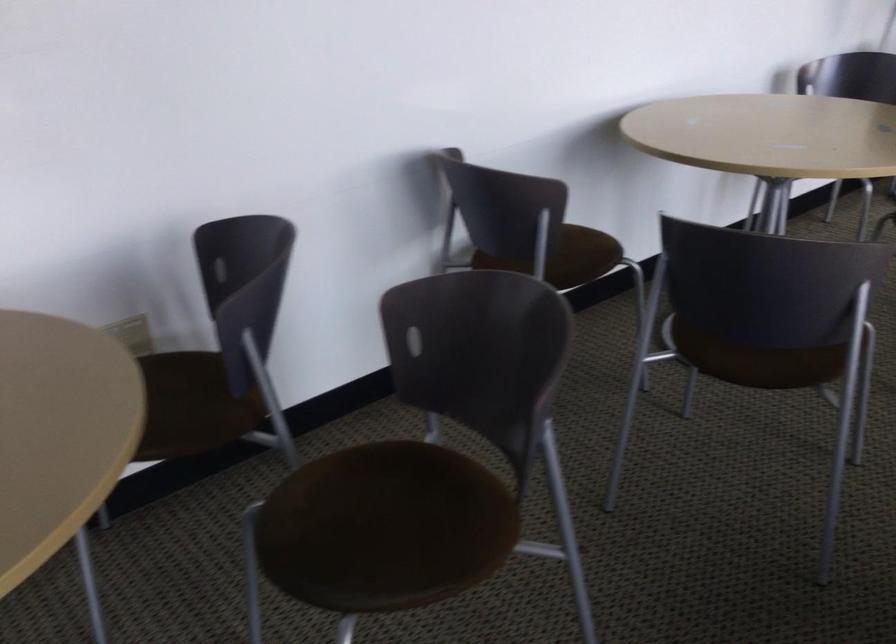
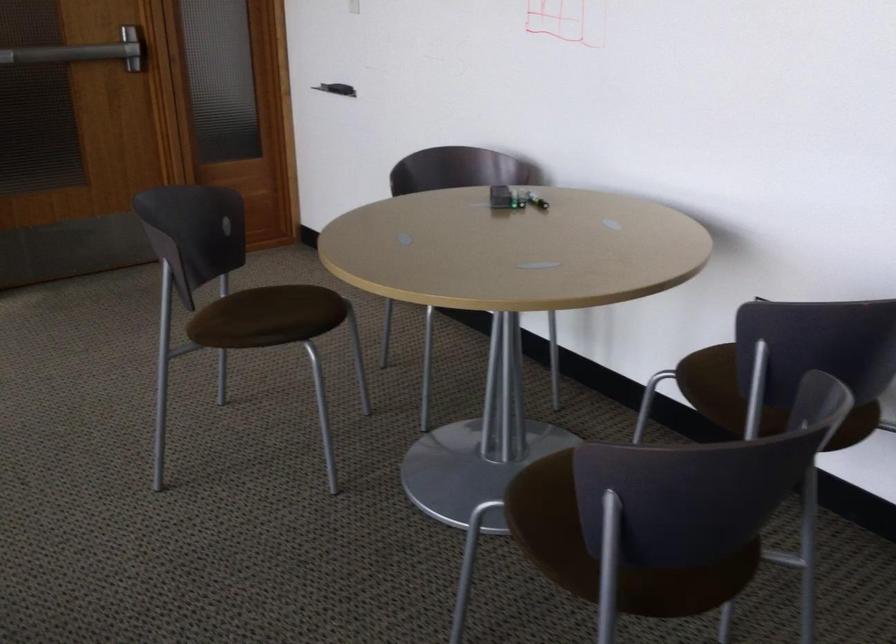
The point at (238, 383) is marked in the first image. Where is the corresponding point in the second image?

(745, 386)